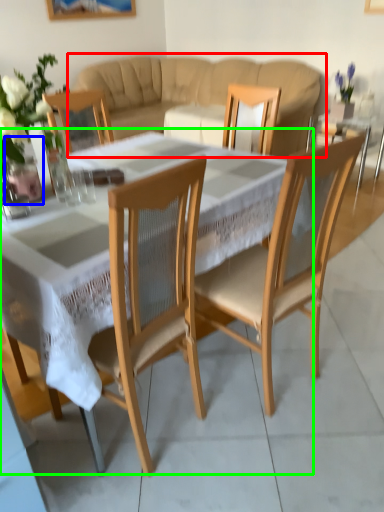
Question: Estimate the real-world distances between objects in this image. Which object is farther from studio couch (highlighted by a red box), glass vase (highlighted by a blue box) or coffee table (highlighted by a green box)?

Choices:
 (A) glass vase
 (B) coffee table

Answer: (A)